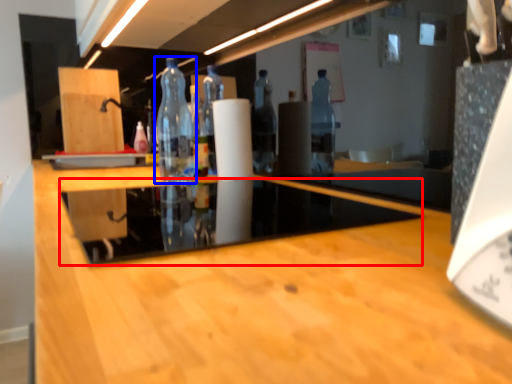
Question: Which of the following is the closest to the observer, glass table (highlighted by a red box) or bottle (highlighted by a blue box)?

Choices:
 (A) glass table
 (B) bottle

Answer: (A)